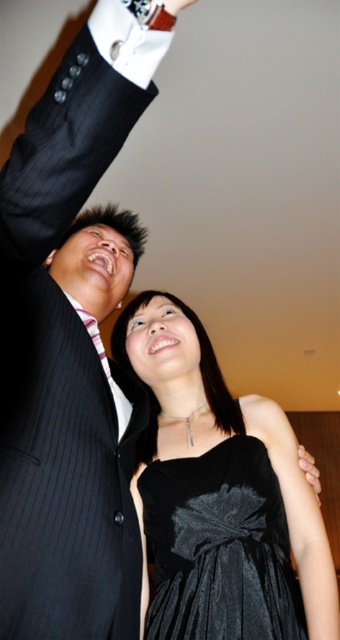
Is the position of black velvet dress at center less distant than that of matte black dress at lower center?

Yes, black velvet dress at center is closer to the viewer.

Which is behind, point (218, 413) or point (313, 465)?

The point (218, 413) is more distant.

You are a GUI agent. You are given a task and a screenshot of the screen. Output one action in this format:
    pyautogui.click(x=<x>, y=<y>)
    Task: Click on the black velvet dress at center
    
    Given the screenshot: What is the action you would take?
    pyautogui.click(x=221, y=493)

Based on the photo, between black velvet dress at center and striped fabric tie at upper left, which one appears on the left side from the viewer's perspective?

striped fabric tie at upper left is more to the left.

Does black velvet dress at center have a greater height compared to striped fabric tie at upper left?

Yes.

Who is more distant from viewer, (298, 496) or (89, 317)?

Positioned behind is point (89, 317).

Where is `black velvet dress at center`? The width and height of the screenshot is (340, 640). black velvet dress at center is located at coordinates (221, 493).

Can you confirm if black velvet dress at lower right is shorter than matte black dress at lower center?

Incorrect, black velvet dress at lower right's height does not fall short of matte black dress at lower center's.

Does point (131, 486) lie behind point (304, 476)?

Yes, point (131, 486) is behind point (304, 476).

Where is `black velvet dress at lower right`? This screenshot has height=640, width=340. black velvet dress at lower right is located at coordinates (142, 547).